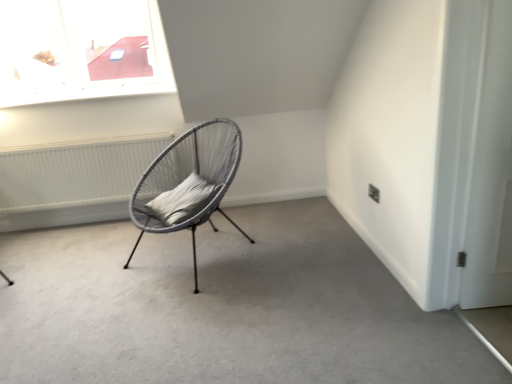
Question: Choose the correct answer: Is white matte door at right inside matte grey wicker chair at center or outside it?

Choices:
 (A) inside
 (B) outside

Answer: (B)

Question: Considering the positions of point (488, 13) and point (174, 188), is point (488, 13) closer or farther from the camera than point (174, 188)?

Choices:
 (A) farther
 (B) closer

Answer: (B)

Question: Which object is the closest to the matte gray chair at center?

Choices:
 (A) white matte door at right
 (B) gray fabric pillow at center
 (C) matte grey wicker chair at center
 (D) white textured radiator at left

Answer: (C)

Question: Considering the real-world distances, which object is farthest from the white textured radiator at left?

Choices:
 (A) matte gray chair at center
 (B) gray fabric pillow at center
 (C) white matte door at right
 (D) matte grey wicker chair at center

Answer: (C)